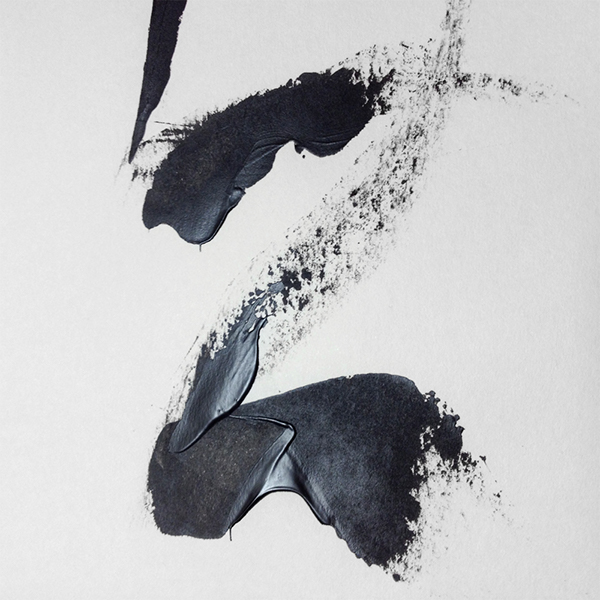
Image resolution: width=600 pixels, height=600 pixels. In order to click on right side of black painting in this screenshot , I will do `click(538, 211)`.